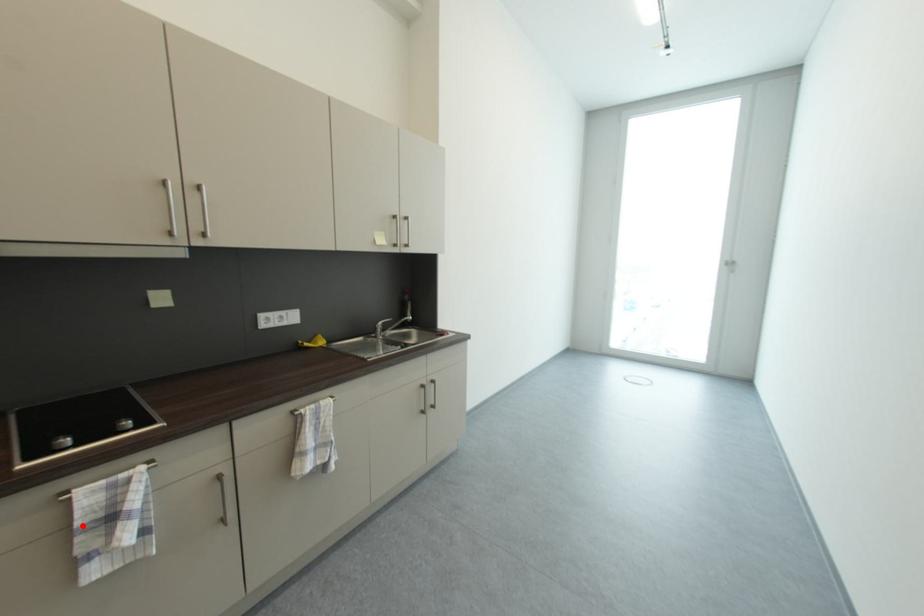
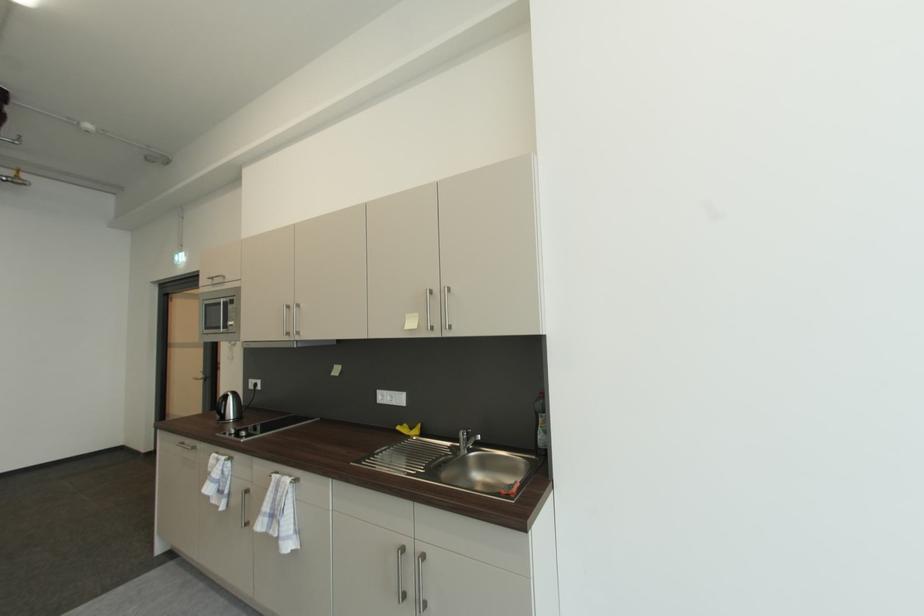
Locate, in the second image, the point that corresponds to the highlighted location in the first image.

(215, 471)